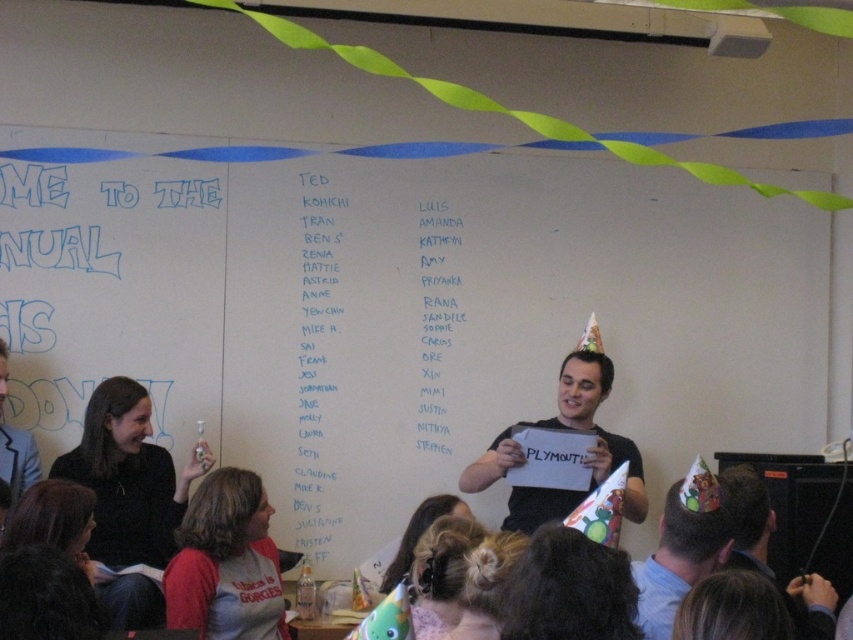
You are a photographer at the event and want to take a photo that includes both the point at (123, 380) and the point at (819, 637). Which point should you focus on to ensure both are in sharp focus?

You should focus on the point at (123, 380) because it is closer to the camera than the point at (819, 637). Focusing on the closer point will keep both in focus as the farther point will be within the depth of field.